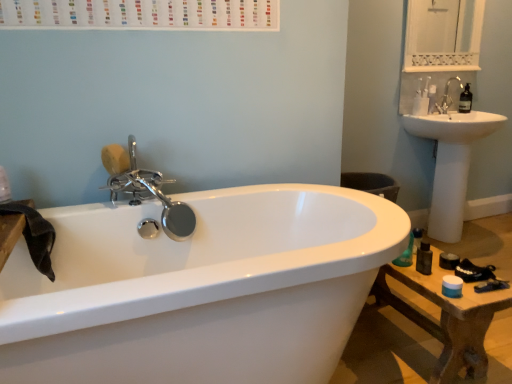
How much space does polished chrome faucet at upper left, arranged as the first tap when viewed from the front, occupy horizontally?

polished chrome faucet at upper left, arranged as the first tap when viewed from the front, is 11.62 inches in width.

Locate an element on the screen. wooden table at lower right is located at coordinates (447, 317).

Measure the distance between white glossy medicine cabinet at upper right and camera.

white glossy medicine cabinet at upper right is 3.38 meters away from camera.

What do you see at coordinates (465, 100) in the screenshot?
I see `clear plastic bottle at upper right` at bounding box center [465, 100].

I want to click on white matte toilet paper at upper right, so click(420, 106).

What is the approximate height of white matte toilet paper at upper right?

4.34 inches.

Image resolution: width=512 pixels, height=384 pixels. What do you see at coordinates (115, 159) in the screenshot?
I see `yellow sponge at upper left` at bounding box center [115, 159].

Identify the location of white glossy sink at upper right. (451, 163).

What's the angular difference between yellow sponge at upper left and wooden table at lower right's facing directions?

The angular difference between yellow sponge at upper left and wooden table at lower right is 60.8 degrees.

Is yellow sponge at upper left positioned beyond the bounds of wooden table at lower right?

yellow sponge at upper left is positioned outside wooden table at lower right.

Does yellow sponge at upper left come in front of wooden table at lower right?

No, yellow sponge at upper left is further to the viewer.

Is white glossy medicine cabinet at upper right bigger or smaller than white matte toilet paper at upper right?

In the image, white glossy medicine cabinet at upper right appears to be larger than white matte toilet paper at upper right.

Is white glossy medicine cabinet at upper right far away from white matte toilet paper at upper right?

white glossy medicine cabinet at upper right is far away from white matte toilet paper at upper right.

This screenshot has height=384, width=512. I want to click on toilet paper behind the white glossy medicine cabinet at upper right, so click(420, 106).

How different are the orientations of clear plastic bottle at upper right and white matte toilet paper at upper right in degrees?

The facing directions of clear plastic bottle at upper right and white matte toilet paper at upper right are 0.000611 degrees apart.

Does clear plastic bottle at upper right appear on the left side of white matte toilet paper at upper right?

In fact, clear plastic bottle at upper right is to the right of white matte toilet paper at upper right.

Does clear plastic bottle at upper right touch white matte toilet paper at upper right?

clear plastic bottle at upper right is not next to white matte toilet paper at upper right, and they're not touching.

Locate an element on the screen. soap dispenser above the white matte toilet paper at upper right (from a real-world perspective) is located at coordinates (465, 100).

Considering the positions of points (408, 115) and (426, 98), is point (408, 115) farther from camera compared to point (426, 98)?

No, (408, 115) is closer to viewer.

Considering the sizes of white glossy sink at upper right and white matte toilet paper at upper right in the image, is white glossy sink at upper right taller or shorter than white matte toilet paper at upper right?

Considering their sizes, white glossy sink at upper right has more height than white matte toilet paper at upper right.

Which is correct: white glossy sink at upper right is inside white matte toilet paper at upper right, or outside of it?

white glossy sink at upper right exists outside the volume of white matte toilet paper at upper right.

Is white glossy medicine cabinet at upper right at the back of satin nickel faucet at upper right, marked as the first tap in a top-to-bottom arrangement?

No, satin nickel faucet at upper right, marked as the first tap in a top-to-bottom arrangement,'s orientation is not away from white glossy medicine cabinet at upper right.

Is the position of satin nickel faucet at upper right, the second tap from the front, less distant than that of white glossy medicine cabinet at upper right?

That is False.

Consider the image. From their relative heights in the image, would you say satin nickel faucet at upper right, which appears as the second tap when ordered from the bottom, is taller or shorter than clear plastic bottle at upper right?

Clearly, satin nickel faucet at upper right, which appears as the second tap when ordered from the bottom, is taller compared to clear plastic bottle at upper right.

Considering the relative sizes of satin nickel faucet at upper right, marked as the 1th tap in a back-to-front arrangement, and clear plastic bottle at upper right in the image provided, is satin nickel faucet at upper right, marked as the 1th tap in a back-to-front arrangement, smaller than clear plastic bottle at upper right?

Incorrect, satin nickel faucet at upper right, marked as the 1th tap in a back-to-front arrangement, is not smaller in size than clear plastic bottle at upper right.

Between satin nickel faucet at upper right, which appears as the second tap when ordered from the bottom, and clear plastic bottle at upper right, which one appears on the right side from the viewer's perspective?

clear plastic bottle at upper right is more to the right.

Looking at this image, what's the angular difference between satin nickel faucet at upper right, marked as the 1th tap in a back-to-front arrangement, and clear plastic bottle at upper right's facing directions?

The facing directions of satin nickel faucet at upper right, marked as the 1th tap in a back-to-front arrangement, and clear plastic bottle at upper right are 2.66 degrees apart.

From a real-world perspective, which object stands above the other?

From a 3D spatial view, white glossy medicine cabinet at upper right is above.

Is point (418, 110) behind point (432, 13)?

That is False.

Which is behind, white matte toilet paper at upper right or white glossy medicine cabinet at upper right?

white matte toilet paper at upper right is further away from the camera.

Find the location of `table below the yellow sponge at upper left (from a real-world perspective)`. table below the yellow sponge at upper left (from a real-world perspective) is located at coordinates (447, 317).

Find the location of a particular element. medicine cabinet above the white matte toilet paper at upper right (from the image's perspective) is located at coordinates (443, 35).

Considering their positions, is satin nickel faucet at upper right, marked as the 1th tap in a back-to-front arrangement, positioned closer to clear plastic bottle at upper right than polished chrome faucet at upper left, arranged as the first tap when viewed from the front?

satin nickel faucet at upper right, marked as the 1th tap in a back-to-front arrangement.

Estimate the real-world distances between objects in this image. Which object is closer to yellow sponge at upper left, satin nickel faucet at upper right, marked as the first tap in a top-to-bottom arrangement, or white glossy sink at upper right?

Based on the image, white glossy sink at upper right appears to be nearer to yellow sponge at upper left.

Considering their positions, is satin nickel faucet at upper right, which ranks as the second tap in left-to-right order, positioned closer to yellow sponge at upper left than white matte toilet paper at upper right?

white matte toilet paper at upper right is closer to yellow sponge at upper left.

Estimate the real-world distances between objects in this image. Which object is closer to wooden table at lower right, clear plastic bottle at upper right or white matte toilet paper at upper right?

white matte toilet paper at upper right is positioned closer to the anchor wooden table at lower right.

Which object lies further to the anchor point white glossy medicine cabinet at upper right, clear plastic bottle at upper right or yellow sponge at upper left?

yellow sponge at upper left is positioned further to the anchor white glossy medicine cabinet at upper right.

When comparing their distances from white glossy sink at upper right, does yellow sponge at upper left or clear plastic bottle at upper right seem closer?

clear plastic bottle at upper right lies closer to white glossy sink at upper right than the other object.

Based on their spatial positions, is white glossy sink at upper right or yellow sponge at upper left further from white glossy medicine cabinet at upper right?

Based on the image, yellow sponge at upper left appears to be further to white glossy medicine cabinet at upper right.

From the image, which object appears to be nearer to yellow sponge at upper left, white glossy medicine cabinet at upper right or polished chrome faucet at upper left, the first tap from the left?

Among the two, polished chrome faucet at upper left, the first tap from the left, is located nearer to yellow sponge at upper left.

Where is `sink between white glossy medicine cabinet at upper right and wooden table at lower right in the up-down direction`? sink between white glossy medicine cabinet at upper right and wooden table at lower right in the up-down direction is located at coordinates (451, 163).

Find the location of a particular element. This screenshot has width=512, height=384. toilet paper located between polished chrome faucet at upper left, which is the 2th tap from right to left, and white glossy medicine cabinet at upper right in the left-right direction is located at coordinates (420, 106).

Find the location of a particular element. tap between yellow sponge at upper left and white glossy medicine cabinet at upper right from left to right is located at coordinates (145, 189).

In order to click on table situated between polished chrome faucet at upper left, arranged as the first tap when viewed from the front, and clear plastic bottle at upper right from left to right in this screenshot , I will do click(x=447, y=317).